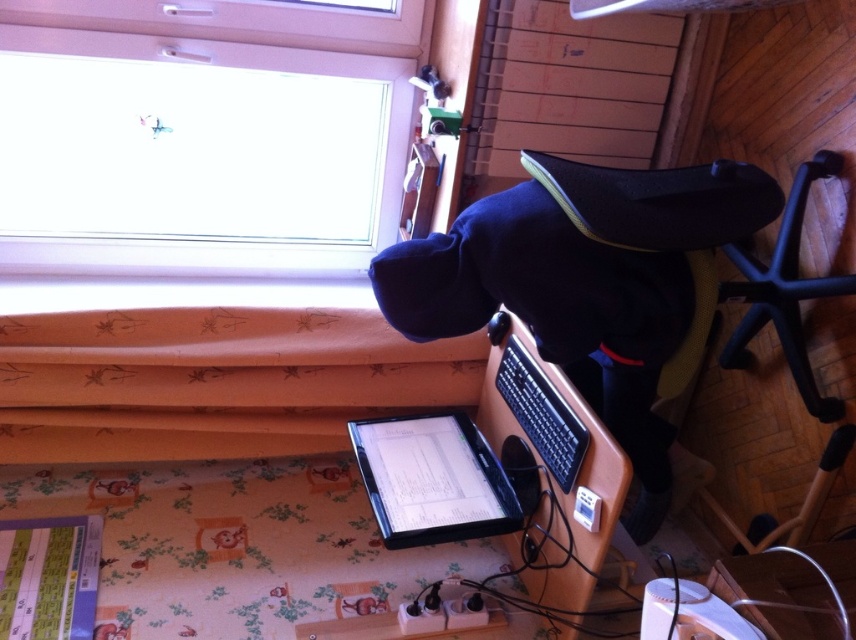
You are a delivery person who needs to place a package on the desk. The package is 20 cm tall. The desk has a transparent glass window at upper left and a satin black laptop at center. Which object on the desk is taller than the package?

The transparent glass window at upper left is much taller than the satin black laptop at center, so it is taller than the 20 cm package.

You are standing in the room and want to see outside. Where should you look to find the transparent glass window at upper left?

The transparent glass window at upper left is located at point coordinates of (201,134).

You are a delivery person who needs to place a 30 inch box on the desk between the transparent glass window at upper left and the black matte laptop at center. Can you fit the box horizontally between them?

The transparent glass window at upper left and the black matte laptop at center are 30.99 inches apart. Since the box is 30 inches wide, it can fit horizontally between them with some space to spare.